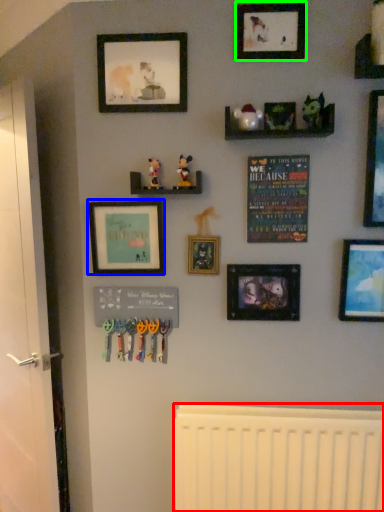
Question: Estimate the real-world distances between objects in this image. Which object is closer to radiator (highlighted by a red box), picture frame (highlighted by a blue box) or picture frame (highlighted by a green box)?

Choices:
 (A) picture frame
 (B) picture frame

Answer: (A)